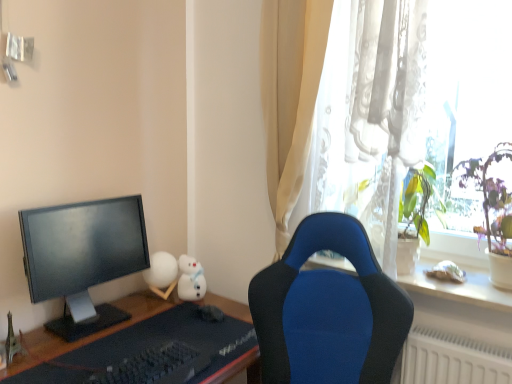
You are a GUI agent. You are given a task and a screenshot of the screen. Output one action in this format:
    pyautogui.click(x=<x>, y=<y>)
    Task: Click on the vacant space that is to the left of white matte plush toy at center, which ranks as the 3th toy in front-to-back order
    The height and width of the screenshot is (384, 512).
    Given the screenshot: What is the action you would take?
    pyautogui.click(x=135, y=300)